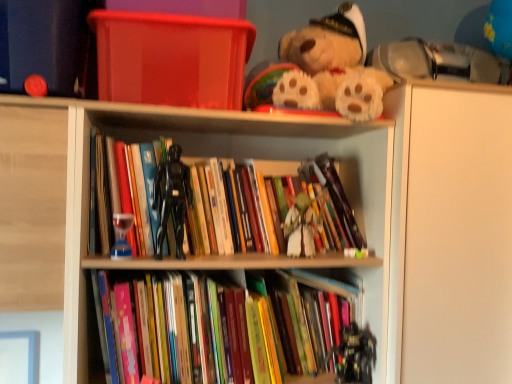
Question: Is translucent glass hourglass at center, acting as the second toy starting from the right, positioned far away from wooden books at center?

Choices:
 (A) yes
 (B) no

Answer: (B)

Question: Are translucent glass hourglass at center, acting as the first toy starting from the top, and wooden books at center making contact?

Choices:
 (A) yes
 (B) no

Answer: (B)

Question: From a real-world perspective, is translucent glass hourglass at center, acting as the 1th toy starting from the front, positioned under wooden books at center based on gravity?

Choices:
 (A) yes
 (B) no

Answer: (B)

Question: From the image's perspective, would you say translucent glass hourglass at center, which is the 2th toy from bottom to top, is positioned over wooden books at center?

Choices:
 (A) no
 (B) yes

Answer: (B)

Question: From a real-world perspective, is translucent glass hourglass at center, acting as the first toy starting from the top, on top of wooden books at center?

Choices:
 (A) no
 (B) yes

Answer: (B)

Question: Is translucent glass hourglass at center, acting as the first toy starting from the left, shorter than wooden books at center?

Choices:
 (A) yes
 (B) no

Answer: (A)

Question: Could hardcover books at center, marked as the second book in a top-to-bottom arrangement, be considered to be inside black plastic robot at lower center, which is counted as the first toy, starting from the bottom?

Choices:
 (A) yes
 (B) no

Answer: (B)

Question: Does black plastic robot at lower center, the 1th toy viewed from the back, lie in front of hardcover books at center, marked as the second book in a top-to-bottom arrangement?

Choices:
 (A) yes
 (B) no

Answer: (B)

Question: Does black plastic robot at lower center, the second toy when ordered from top to bottom, have a lesser width compared to hardcover books at center, which is the first book in bottom-to-top order?

Choices:
 (A) no
 (B) yes

Answer: (B)

Question: From a real-world perspective, is black plastic robot at lower center, which is counted as the first toy, starting from the bottom, beneath hardcover books at center, which is the first book in bottom-to-top order?

Choices:
 (A) no
 (B) yes

Answer: (B)

Question: Is black plastic robot at lower center, which is counted as the first toy, starting from the bottom, positioned far away from hardcover books at center, which is the first book in bottom-to-top order?

Choices:
 (A) no
 (B) yes

Answer: (A)

Question: Is black plastic robot at lower center, which is counted as the first toy, starting from the bottom, facing away from hardcover books at center, which is the first book in bottom-to-top order?

Choices:
 (A) yes
 (B) no

Answer: (A)

Question: Is the position of fluffy beige teddy bear at upper center more distant than that of wooden books at center?

Choices:
 (A) yes
 (B) no

Answer: (A)